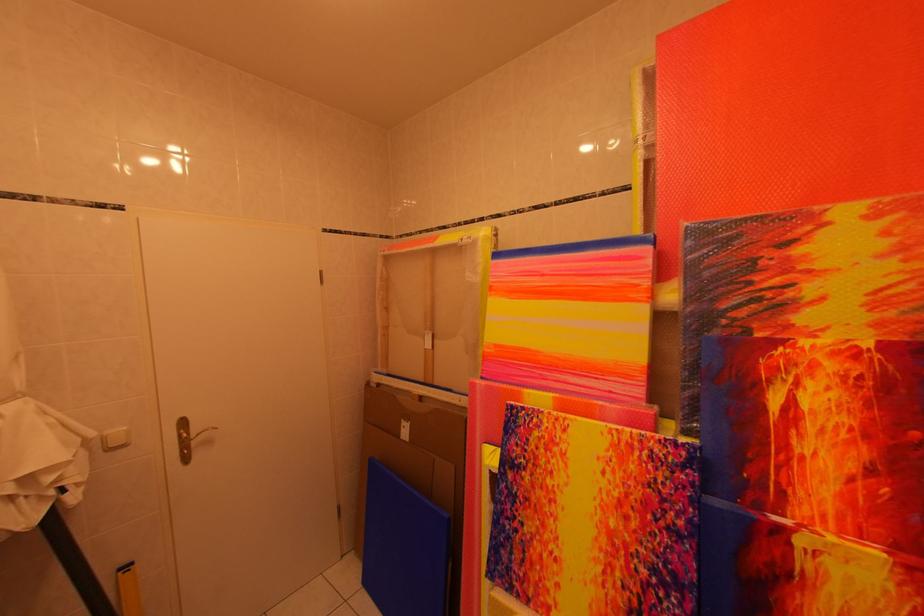
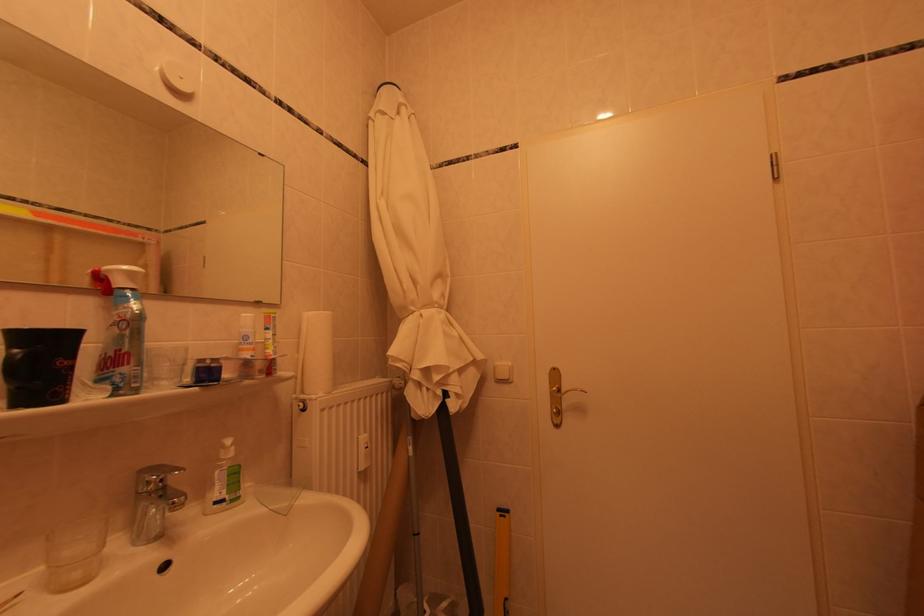
The point at (203, 439) is marked in the first image. Where is the corresponding point in the second image?

(572, 395)